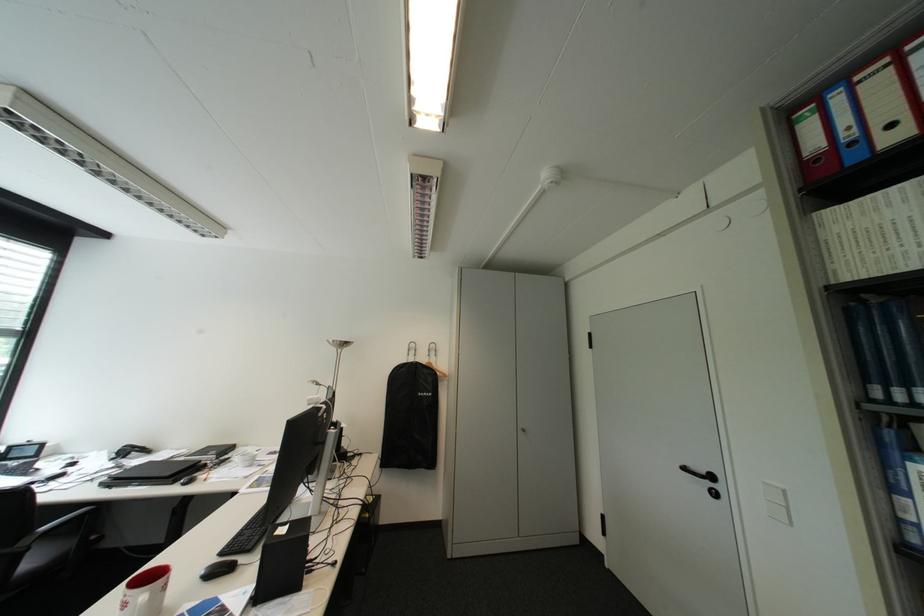
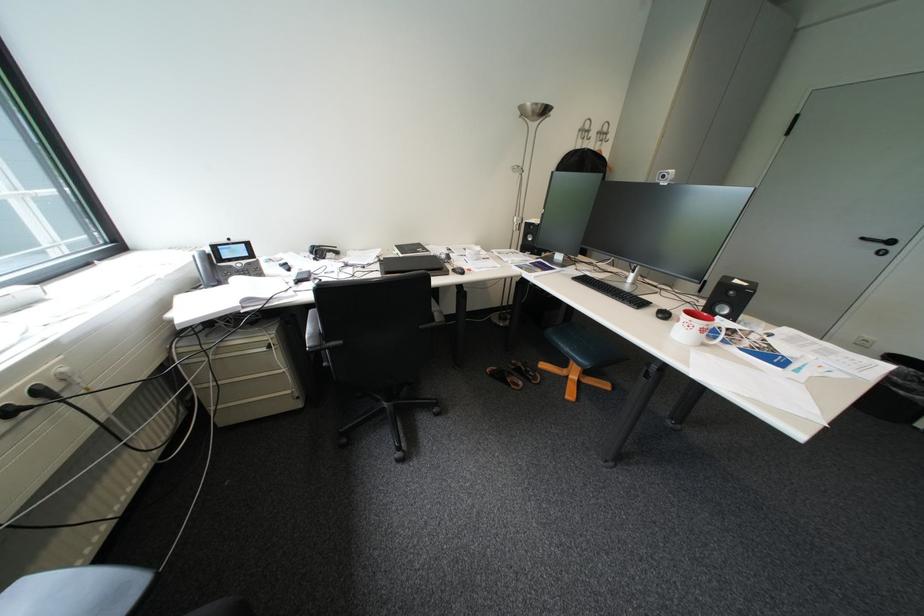
Where in the second image is the point corresponding to the point at 724,477 from the first image?

(904, 243)